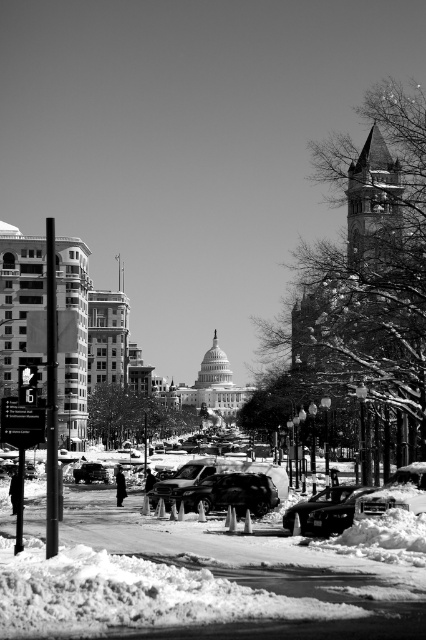
Looking at this image, you are a delivery driver trying to navigate through the snow in Washington D.C. You see a shiny black suv at center and a shiny black sedan at center. Which vehicle is closer to you?

The shiny black suv at center is closer to you because the shiny black sedan at center is behind it.

You are a delivery driver trying to navigate through the snow in the winter scene. You see a shiny black suv at center and a shiny black sedan at center. Which vehicle is closer to the left side of the road?

The shiny black suv at center is positioned on the left side of the shiny black sedan at center, so the shiny black suv at center is closer to the left side of the road.

You are standing at the point marked by the coordinates point (233,481) in the winter scene of Washington D.C. You want to walk to the U.S. Capitol Building, which is visible in the background. Considering the snow coverage and the distance between you and the Capitol, do you think you can reach it within 10 minutes at a normal walking pace?

The distance between you and the point (233,481) is 104.22 meters. However, the question mentions the U.S. Capitol Building in the background. Since the provided object description only specifies the distance to the point, not the Capitol, we cannot determine the distance to the Capitol. Therefore, it is impossible to estimate if you can reach it within 10 minutes.